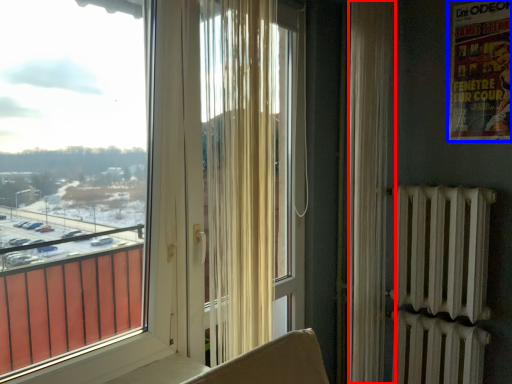
Question: Which point is further to the camera, curtain (highlighted by a red box) or poster page (highlighted by a blue box)?

Choices:
 (A) curtain
 (B) poster page

Answer: (B)